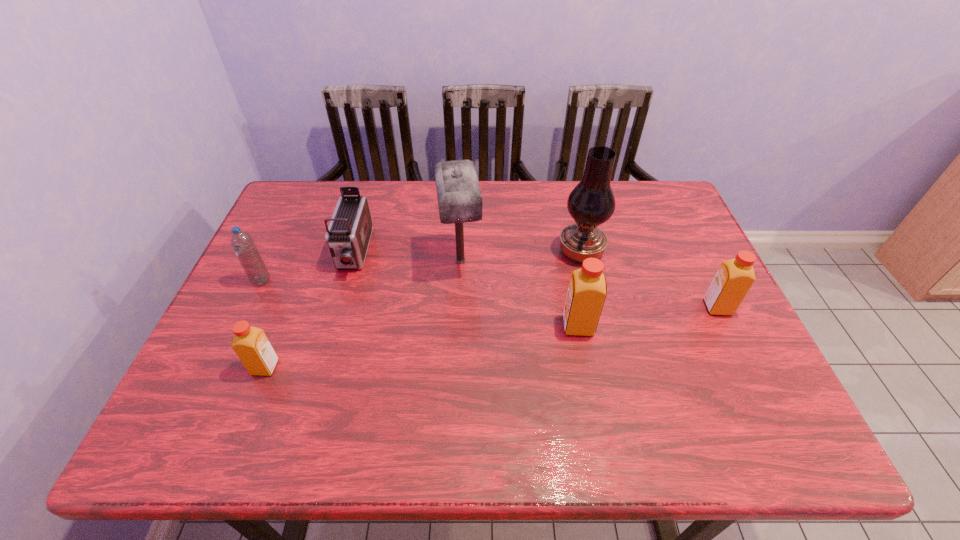
Identify the location of vacant space that's between the fifth object from right to left and the fourth object from right to left. This screenshot has width=960, height=540. (407, 256).

The image size is (960, 540). Find the location of `vacant point located between the leftmost object and the second orange juice from right to left`. vacant point located between the leftmost object and the second orange juice from right to left is located at coordinates (420, 303).

The height and width of the screenshot is (540, 960). I want to click on vacant area that lies between the shortest orange juice and the rightmost orange juice, so click(x=492, y=338).

Find the location of `empty space that is in between the leftmost object and the fourth object from right to left`. empty space that is in between the leftmost object and the fourth object from right to left is located at coordinates (361, 271).

Where is `free point between the leftmost object and the rightmost orange juice`? The height and width of the screenshot is (540, 960). free point between the leftmost object and the rightmost orange juice is located at coordinates (490, 294).

The width and height of the screenshot is (960, 540). What are the coordinates of `vacant point located between the leftmost object and the mallet` in the screenshot? It's located at (361, 271).

Select which object is the sixth closest to the leftmost object. Please provide its 2D coordinates. Your answer should be formatted as a tuple, i.e. [(x, y)], where the tuple contains the x and y coordinates of a point satisfying the conditions above.

[(734, 278)]

Locate which object is the fifth closest to the second orange juice from right to left. Please provide its 2D coordinates. Your answer should be formatted as a tuple, i.e. [(x, y)], where the tuple contains the x and y coordinates of a point satisfying the conditions above.

[(251, 345)]

Point out which orange juice is positioned as the nearest to the second orange juice from left to right. Please provide its 2D coordinates. Your answer should be formatted as a tuple, i.e. [(x, y)], where the tuple contains the x and y coordinates of a point satisfying the conditions above.

[(734, 278)]

Identify the location of the second closest orange juice relative to the water bottle. (587, 290).